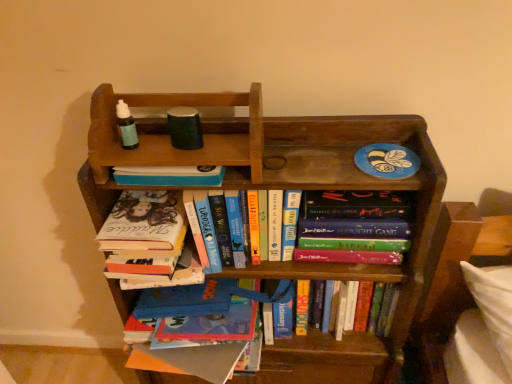
Question: Is hardcover book at center, which appears as the 3th book when viewed from the top, thinner than wooden bookcase at center?

Choices:
 (A) no
 (B) yes

Answer: (B)

Question: Does hardcover book at center, which appears as the 3th book when viewed from the top, appear on the right side of wooden bookcase at center?

Choices:
 (A) no
 (B) yes

Answer: (B)

Question: Are hardcover book at center, which appears as the 3th book when viewed from the top, and wooden bookcase at center far apart?

Choices:
 (A) yes
 (B) no

Answer: (B)

Question: From a real-world perspective, is hardcover book at center, arranged as the first book when ordered from the bottom, below wooden bookcase at center?

Choices:
 (A) yes
 (B) no

Answer: (B)

Question: From the image's perspective, is hardcover book at center, which appears as the 3th book when viewed from the top, on top of wooden bookcase at center?

Choices:
 (A) no
 (B) yes

Answer: (A)

Question: Which is correct: wooden bookcase at center is inside hardcover book at center, positioned as the first book in top-to-bottom order, or outside of it?

Choices:
 (A) outside
 (B) inside

Answer: (A)

Question: Is wooden bookcase at center bigger or smaller than hardcover book at center, acting as the 3th book starting from the bottom?

Choices:
 (A) big
 (B) small

Answer: (A)

Question: Does point (240, 130) appear closer or farther from the camera than point (206, 269)?

Choices:
 (A) closer
 (B) farther

Answer: (A)

Question: From a real-world perspective, relative to hardcover book at center, acting as the 3th book starting from the bottom, is wooden bookcase at center vertically above or below?

Choices:
 (A) below
 (B) above

Answer: (A)

Question: Is hardcover book at center, arranged as the first book when ordered from the bottom, situated inside wooden bookcase at center or outside?

Choices:
 (A) inside
 (B) outside

Answer: (A)

Question: Is hardcover book at center, which appears as the 3th book when viewed from the top, to the left or to the right of wooden bookcase at center in the image?

Choices:
 (A) right
 (B) left

Answer: (A)

Question: Considering the positions of hardcover book at center, arranged as the first book when ordered from the bottom, and wooden bookcase at center in the image, is hardcover book at center, arranged as the first book when ordered from the bottom, taller or shorter than wooden bookcase at center?

Choices:
 (A) short
 (B) tall

Answer: (A)

Question: Is hardcover book at center, arranged as the first book when ordered from the bottom, in front of or behind wooden bookcase at center in the image?

Choices:
 (A) front
 (B) behind

Answer: (B)

Question: From a real-world perspective, is hardcover book at center, acting as the 3th book starting from the bottom, positioned above or below wooden bookcase at center?

Choices:
 (A) below
 (B) above

Answer: (B)

Question: Relative to wooden bookcase at center, is hardcover book at center, positioned as the first book in top-to-bottom order, in front or behind?

Choices:
 (A) behind
 (B) front

Answer: (A)